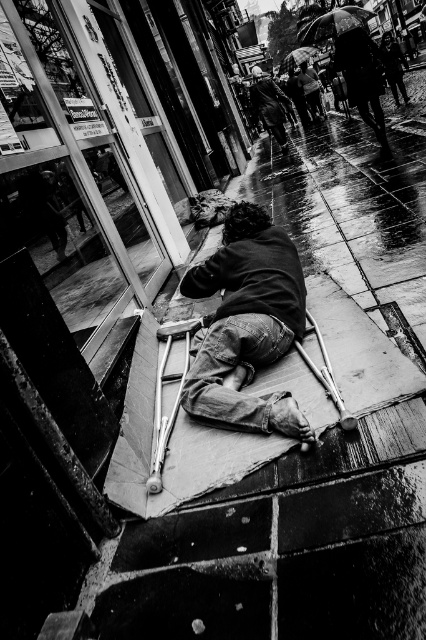
Question: Does dark fabric umbrella at upper right appear over black matte umbrella at upper center?

Choices:
 (A) yes
 (B) no

Answer: (B)

Question: Which object appears farthest from the camera in this image?

Choices:
 (A) dark fabric umbrella at upper right
 (B) black matte umbrella at upper center

Answer: (B)

Question: Can you confirm if denim jeans at lower center is wider than shiny black umbrella at upper center?

Choices:
 (A) yes
 (B) no

Answer: (B)

Question: Does dark fabric umbrella at upper right have a smaller size compared to ragged clothing at center?

Choices:
 (A) yes
 (B) no

Answer: (A)

Question: Which of the following is the closest to the observer?

Choices:
 (A) (322, 10)
 (B) (287, 250)
 (C) (259, 112)
 (D) (342, 51)

Answer: (B)

Question: Which is farther from the denim jeans at lower center?

Choices:
 (A) black matte umbrella at upper center
 (B) ragged clothing at center
 (C) shiny black umbrella at upper center
 (D) dark fabric umbrella at upper right

Answer: (C)